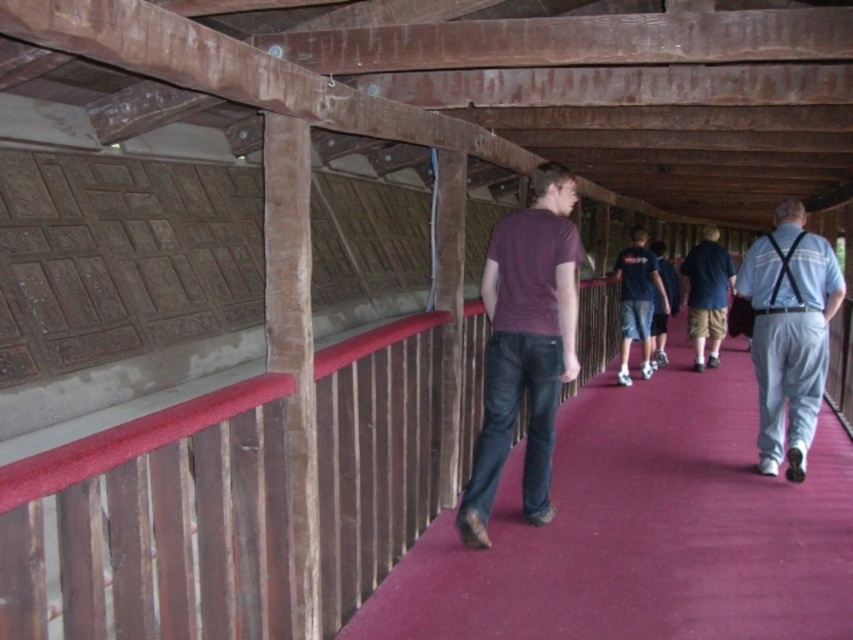
Which is more to the right, gray cotton pants at right or dark blue shirt at center?

Positioned to the right is dark blue shirt at center.

Which is in front, point (780, 420) or point (715, 268)?

Point (780, 420)

The height and width of the screenshot is (640, 853). What are the coordinates of `gray cotton pants at right` in the screenshot? It's located at (788, 332).

Identify the location of gray cotton pants at right. Image resolution: width=853 pixels, height=640 pixels. (788, 332).

Based on the photo, is maroon carpet at center bigger than maroon t-shirt at center?

No.

This screenshot has width=853, height=640. What do you see at coordinates (643, 531) in the screenshot?
I see `maroon carpet at center` at bounding box center [643, 531].

The height and width of the screenshot is (640, 853). What do you see at coordinates (643, 531) in the screenshot?
I see `maroon carpet at center` at bounding box center [643, 531].

The height and width of the screenshot is (640, 853). Identify the location of maroon carpet at center. (643, 531).

Can you confirm if gray cotton pants at right is positioned below dark blue t-shirt at center?

Yes, gray cotton pants at right is below dark blue t-shirt at center.

Measure the distance between gray cotton pants at right and camera.

A distance of 15.00 feet exists between gray cotton pants at right and camera.

Locate an element on the screen. gray cotton pants at right is located at coordinates (788, 332).